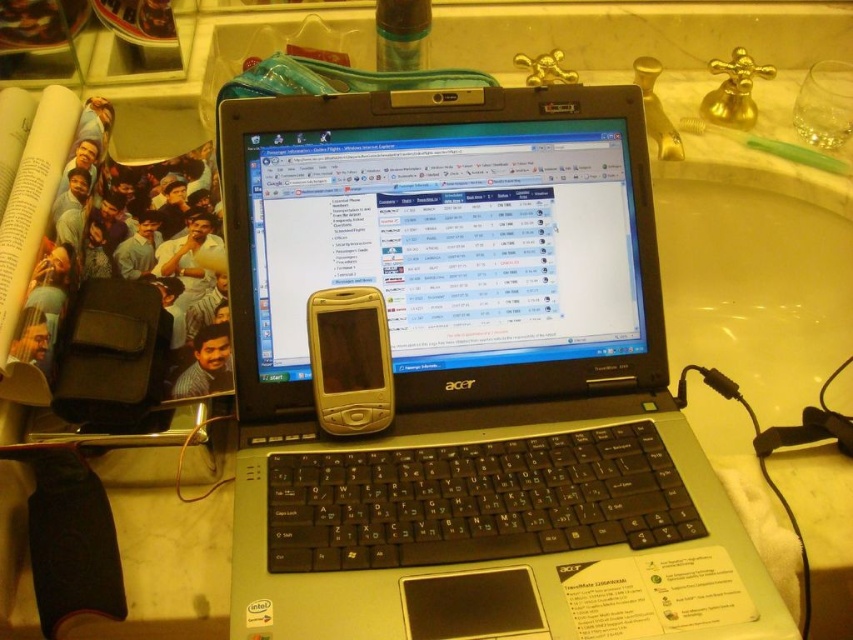
Question: Does black plastic laptop at center have a smaller size compared to gold plastic phone at center?

Choices:
 (A) yes
 (B) no

Answer: (B)

Question: Which point is farther from the camera taking this photo?

Choices:
 (A) (331, 384)
 (B) (317, 584)

Answer: (A)

Question: Among these points, which one is farthest from the camera?

Choices:
 (A) tap(262, 637)
 (B) tap(341, 360)

Answer: (B)

Question: Can you confirm if black plastic laptop at center is positioned above gold plastic phone at center?

Choices:
 (A) no
 (B) yes

Answer: (B)

Question: Which of the following is the closest to the observer?

Choices:
 (A) black plastic laptop at center
 (B) gold plastic phone at center

Answer: (A)

Question: Is the position of black plastic laptop at center more distant than that of gold plastic phone at center?

Choices:
 (A) no
 (B) yes

Answer: (A)